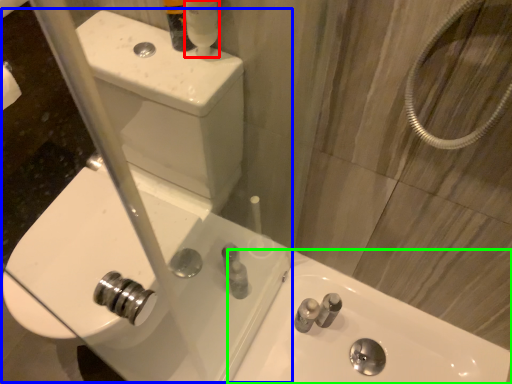
Question: Based on their relative distances, which object is farther from mouthwash (highlighted by a red box)? Choose from sink (highlighted by a blue box) and sink (highlighted by a green box).

Choices:
 (A) sink
 (B) sink

Answer: (B)